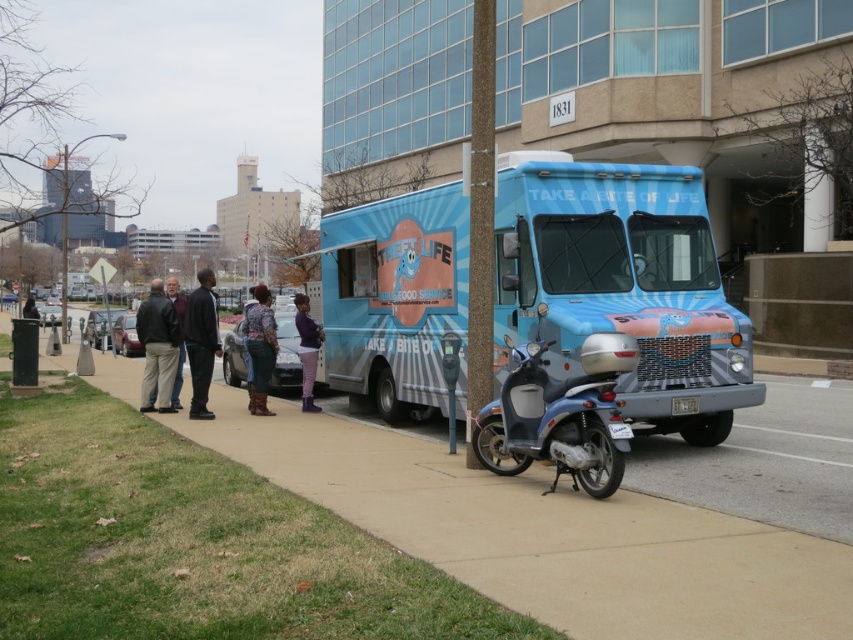
You are a delivery person who needs to quickly grab a jacket from the sidewalk between the black leather jacket at center and the patterned fabric jacket at center. The jacket you need is the one closer to the vibrant blue food truck. Which jacket should you choose?

The black leather jacket at center is closer to the vibrant blue food truck, so you should choose the black leather jacket at center.

You are standing in front of the food truck and want to take a photo of the two points mentioned. Which point, point [608,467] or point [206,358], will appear larger in your photo?

Point [608,467] will appear larger in the photo because it is closer to the camera than point [206,358].

Consider the image. You are a customer standing in front of the vibrant blue food truck parked along the curb. You see two jackets hanging on a rack near the truck entrance. Which jacket is taller between the black leather jacket at center and the patterned fabric jacket at center?

The black leather jacket at center is taller than the patterned fabric jacket at center.